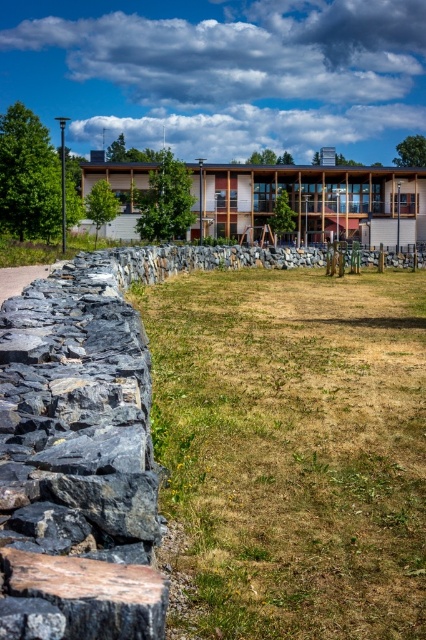
Question: Among these points, which one is nearest to the camera?

Choices:
 (A) (57, 426)
 (B) (423, 518)

Answer: (A)

Question: Is dry grass at center wider than dark gray rough stone wall at left?

Choices:
 (A) yes
 (B) no

Answer: (A)

Question: Is dry grass at center behind dark gray rough stone wall at left?

Choices:
 (A) no
 (B) yes

Answer: (B)

Question: Is dry grass at center wider than dark gray rough stone wall at left?

Choices:
 (A) yes
 (B) no

Answer: (A)

Question: Which of the following is the farthest from the observer?

Choices:
 (A) (382, 412)
 (B) (69, 264)

Answer: (B)